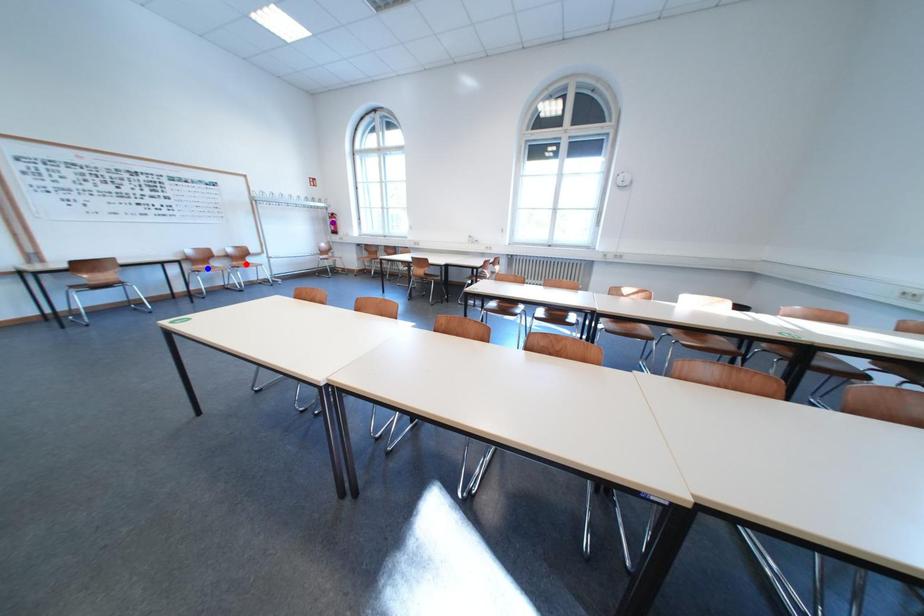
Order these from nearest to farthest:
- blue point
- red point
- purple point

blue point → red point → purple point